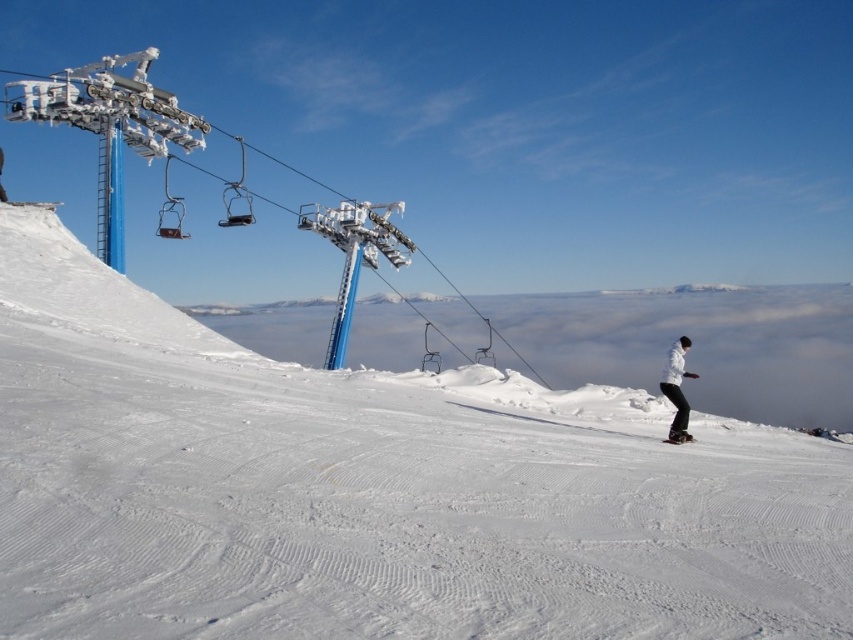
Who is more forward, [674,436] or [679,435]?

Positioned in front is point [674,436].

Does white matte ski at lower right have a lesser width compared to white matte snowboard at right?

In fact, white matte ski at lower right might be wider than white matte snowboard at right.

Which is behind, point (695, 440) or point (692, 438)?

The point (695, 440) is more distant.

Identify the location of white matte ski at lower right. (677, 436).

Between white powdery snow at center and white matte snowboard at right, which one is positioned lower?

Positioned lower is white matte snowboard at right.

Does white powdery snow at center have a greater width compared to white matte snowboard at right?

Indeed, white powdery snow at center has a greater width compared to white matte snowboard at right.

You are a GUI agent. You are given a task and a screenshot of the screen. Output one action in this format:
    pyautogui.click(x=<x>, y=<y>)
    Task: Click on the white powdery snow at center
    Image resolution: width=853 pixels, height=640 pixels.
    Given the screenshot: What is the action you would take?
    pyautogui.click(x=372, y=490)

Is white powdery snow at center shorter than white matte snowboarder at right?

No, white powdery snow at center is not shorter than white matte snowboarder at right.

The height and width of the screenshot is (640, 853). What do you see at coordinates (372, 490) in the screenshot? I see `white powdery snow at center` at bounding box center [372, 490].

Find the location of a particular element. Image resolution: width=853 pixels, height=640 pixels. white powdery snow at center is located at coordinates (372, 490).